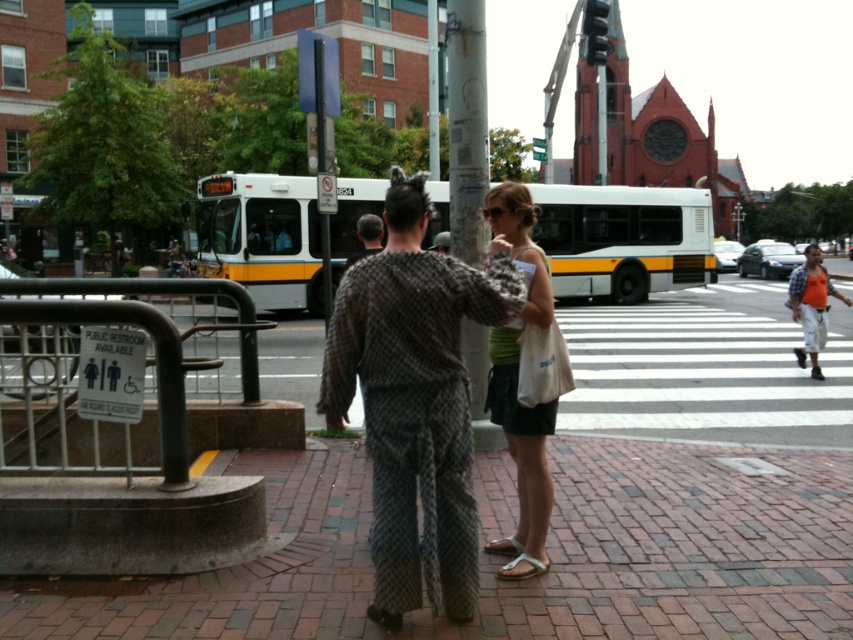
Can you confirm if white/yellow bus at center is smaller than dark gray textured shirt at center?

No, white/yellow bus at center is not smaller than dark gray textured shirt at center.

Does white/yellow bus at center have a larger size compared to dark gray textured shirt at center?

Yes, white/yellow bus at center is bigger than dark gray textured shirt at center.

This screenshot has height=640, width=853. I want to click on white/yellow bus at center, so click(624, 237).

Can you confirm if patterned fabric jumpsuit at center is smaller than green jersey at center?

Actually, patterned fabric jumpsuit at center might be larger than green jersey at center.

Is point (454, 484) positioned before point (544, 285)?

Yes, it is in front of point (544, 285).

The width and height of the screenshot is (853, 640). Describe the element at coordinates (415, 401) in the screenshot. I see `patterned fabric jumpsuit at center` at that location.

Locate an element on the screen. This screenshot has height=640, width=853. patterned fabric jumpsuit at center is located at coordinates (415, 401).

Between patterned fabric jumpsuit at center and orange t-shirt at center, which one appears on the right side from the viewer's perspective?

orange t-shirt at center

In the scene shown: Is patterned fabric jumpsuit at center positioned at the back of orange t-shirt at center?

No, patterned fabric jumpsuit at center is closer to the viewer.

Which is in front, point (334, 356) or point (810, 269)?

Positioned in front is point (334, 356).

Where is `patterned fabric jumpsuit at center`? This screenshot has width=853, height=640. patterned fabric jumpsuit at center is located at coordinates (415, 401).